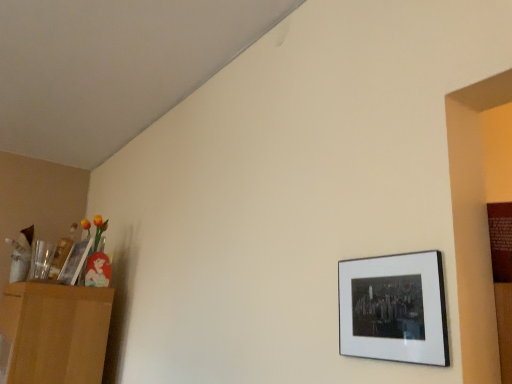
The image size is (512, 384). In order to click on wooden picture frame at left, positioned as the first picture frame in back-to-front order in this screenshot , I will do `click(75, 262)`.

Identify the location of light brown wooden dresser at left. (55, 333).

What do you see at coordinates (394, 308) in the screenshot? The width and height of the screenshot is (512, 384). I see `matte black picture frame at lower right, marked as the 1th picture frame in a front-to-back arrangement` at bounding box center [394, 308].

Measure the distance between point (440, 333) and camera.

Point (440, 333) is 30.39 inches away from camera.

Where is `wooden picture frame at left, arranged as the 2th picture frame when viewed from the front`? This screenshot has width=512, height=384. wooden picture frame at left, arranged as the 2th picture frame when viewed from the front is located at coordinates (75, 262).

Would you say wooden picture frame at left, which ranks as the 1th picture frame in left-to-right order, is a long distance from matte black picture frame at lower right, the second picture frame when ordered from back to front?

Yes, wooden picture frame at left, which ranks as the 1th picture frame in left-to-right order, and matte black picture frame at lower right, the second picture frame when ordered from back to front, are quite far apart.

Considering the sizes of objects wooden picture frame at left, arranged as the 2th picture frame when viewed from the front, and matte black picture frame at lower right, marked as the 1th picture frame in a front-to-back arrangement, in the image provided, who is shorter, wooden picture frame at left, arranged as the 2th picture frame when viewed from the front, or matte black picture frame at lower right, marked as the 1th picture frame in a front-to-back arrangement,?

matte black picture frame at lower right, marked as the 1th picture frame in a front-to-back arrangement.

Considering the positions of objects wooden picture frame at left, the 2th picture frame from the right, and matte black picture frame at lower right, positioned as the 2th picture frame in left-to-right order, in the image provided, who is more to the right, wooden picture frame at left, the 2th picture frame from the right, or matte black picture frame at lower right, positioned as the 2th picture frame in left-to-right order,?

matte black picture frame at lower right, positioned as the 2th picture frame in left-to-right order.

Is light brown wooden dresser at left placed right next to matte black picture frame at lower right, the second picture frame when ordered from back to front?

They are not placed beside each other.

The image size is (512, 384). Identify the location of dresser below the matte black picture frame at lower right, positioned as the 2th picture frame in left-to-right order (from a real-world perspective). (55, 333).

Between light brown wooden dresser at left and matte black picture frame at lower right, positioned as the 2th picture frame in left-to-right order, which one is positioned behind?

light brown wooden dresser at left is behind.

Based on their positions, is light brown wooden dresser at left located to the left or right of matte black picture frame at lower right, the second picture frame when ordered from back to front?

light brown wooden dresser at left is positioned on matte black picture frame at lower right, the second picture frame when ordered from back to front,'s left side.

Is wooden picture frame at left, which ranks as the 1th picture frame in left-to-right order, oriented towards light brown wooden dresser at left?

No, wooden picture frame at left, which ranks as the 1th picture frame in left-to-right order, is not turned towards light brown wooden dresser at left.

Does wooden picture frame at left, the 2th picture frame from the right, lie in front of light brown wooden dresser at left?

That is False.

Is wooden picture frame at left, positioned as the first picture frame in back-to-front order, spatially inside light brown wooden dresser at left, or outside of it?

wooden picture frame at left, positioned as the first picture frame in back-to-front order, exists outside the volume of light brown wooden dresser at left.

Does wooden picture frame at left, the 2th picture frame from the right, have a greater width compared to light brown wooden dresser at left?

No, wooden picture frame at left, the 2th picture frame from the right, is not wider than light brown wooden dresser at left.

Is wooden picture frame at left, arranged as the 2th picture frame when viewed from the front, located within light brown wooden dresser at left?

Definitely not — wooden picture frame at left, arranged as the 2th picture frame when viewed from the front, is not inside light brown wooden dresser at left.

From a real-world perspective, is light brown wooden dresser at left physically below wooden picture frame at left, which ranks as the 1th picture frame in left-to-right order?

Correct, in the physical world, light brown wooden dresser at left is lower than wooden picture frame at left, which ranks as the 1th picture frame in left-to-right order.

Is light brown wooden dresser at left turned away from wooden picture frame at left, arranged as the 2th picture frame when viewed from the front?

No, light brown wooden dresser at left is not facing away from wooden picture frame at left, arranged as the 2th picture frame when viewed from the front.

You are a GUI agent. You are given a task and a screenshot of the screen. Output one action in this format:
    pyautogui.click(x=<x>, y=<y>)
    Task: Click on the picture frame in front of the wooden picture frame at left, the 2th picture frame from the right
    
    Given the screenshot: What is the action you would take?
    pyautogui.click(x=394, y=308)

Are matte black picture frame at lower right, positioned as the 1th picture frame in right-to-left order, and wooden picture frame at left, positioned as the first picture frame in back-to-front order, beside each other?

No, matte black picture frame at lower right, positioned as the 1th picture frame in right-to-left order, is not in contact with wooden picture frame at left, positioned as the first picture frame in back-to-front order.

Is matte black picture frame at lower right, marked as the 1th picture frame in a front-to-back arrangement, looking in the opposite direction of wooden picture frame at left, which ranks as the 1th picture frame in left-to-right order?

No.

From a real-world perspective, which object stands above the other?

wooden picture frame at left, the 2th picture frame from the right, is physically above.

From a real-world perspective, relative to light brown wooden dresser at left, is matte black picture frame at lower right, positioned as the 1th picture frame in right-to-left order, vertically above or below?

From a real-world perspective, matte black picture frame at lower right, positioned as the 1th picture frame in right-to-left order, is physically above light brown wooden dresser at left.

Considering the relative sizes of matte black picture frame at lower right, the second picture frame when ordered from back to front, and light brown wooden dresser at left in the image provided, is matte black picture frame at lower right, the second picture frame when ordered from back to front, wider than light brown wooden dresser at left?

No, matte black picture frame at lower right, the second picture frame when ordered from back to front, is not wider than light brown wooden dresser at left.

Does matte black picture frame at lower right, positioned as the 2th picture frame in left-to-right order, come in front of light brown wooden dresser at left?

Yes, matte black picture frame at lower right, positioned as the 2th picture frame in left-to-right order, is in front of light brown wooden dresser at left.

In the image, there is a wooden picture frame at left, which ranks as the 1th picture frame in left-to-right order. In order to click on picture frame below it (from a real-world perspective) in this screenshot , I will do `click(394, 308)`.

In order to click on picture frame in front of the light brown wooden dresser at left in this screenshot , I will do `click(394, 308)`.

Estimate the real-world distances between objects in this image. Which object is closer to matte black picture frame at lower right, marked as the 1th picture frame in a front-to-back arrangement, wooden picture frame at left, the 2th picture frame from the right, or light brown wooden dresser at left?

light brown wooden dresser at left is closer to matte black picture frame at lower right, marked as the 1th picture frame in a front-to-back arrangement.

Based on their spatial positions, is matte black picture frame at lower right, the second picture frame when ordered from back to front, or light brown wooden dresser at left closer to wooden picture frame at left, arranged as the 2th picture frame when viewed from the front?

The object closer to wooden picture frame at left, arranged as the 2th picture frame when viewed from the front, is light brown wooden dresser at left.

Looking at the image, which one is located closer to matte black picture frame at lower right, positioned as the 1th picture frame in right-to-left order, light brown wooden dresser at left or wooden picture frame at left, arranged as the 2th picture frame when viewed from the front?

Based on the image, light brown wooden dresser at left appears to be nearer to matte black picture frame at lower right, positioned as the 1th picture frame in right-to-left order.

Estimate the real-world distances between objects in this image. Which object is closer to light brown wooden dresser at left, wooden picture frame at left, which ranks as the 1th picture frame in left-to-right order, or matte black picture frame at lower right, marked as the 1th picture frame in a front-to-back arrangement?

The object closer to light brown wooden dresser at left is wooden picture frame at left, which ranks as the 1th picture frame in left-to-right order.

From the image, which object appears to be farther from light brown wooden dresser at left, matte black picture frame at lower right, positioned as the 1th picture frame in right-to-left order, or wooden picture frame at left, positioned as the first picture frame in back-to-front order?

matte black picture frame at lower right, positioned as the 1th picture frame in right-to-left order, is further to light brown wooden dresser at left.

Considering their positions, is light brown wooden dresser at left positioned closer to wooden picture frame at left, which ranks as the 1th picture frame in left-to-right order, than matte black picture frame at lower right, marked as the 1th picture frame in a front-to-back arrangement?

light brown wooden dresser at left.

The width and height of the screenshot is (512, 384). Find the location of `picture frame situated between light brown wooden dresser at left and matte black picture frame at lower right, positioned as the 2th picture frame in left-to-right order, from left to right`. picture frame situated between light brown wooden dresser at left and matte black picture frame at lower right, positioned as the 2th picture frame in left-to-right order, from left to right is located at coordinates (75, 262).